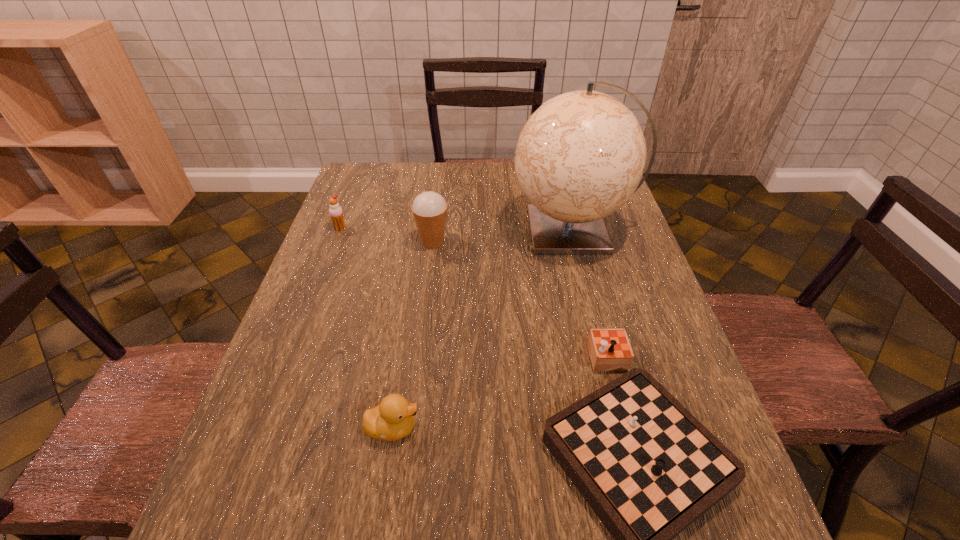
At what (x,y) coordinates should I click in order to perform the action: click on free spot between the globe and the duckling. Please return your answer as a coordinate pair (x, y). Looking at the image, I should click on (482, 329).

The height and width of the screenshot is (540, 960). I want to click on free spot between the duckling and the farther icecream, so click(367, 328).

You are a GUI agent. You are given a task and a screenshot of the screen. Output one action in this format:
    pyautogui.click(x=<x>, y=<y>)
    Task: Click on the vacant space that is in between the leftmost object and the duckling
    
    Given the screenshot: What is the action you would take?
    pyautogui.click(x=367, y=328)

At what (x,y) coordinates should I click in order to perform the action: click on vacant area between the right icecream and the tallest object. Please return your answer as a coordinate pair (x, y). The image size is (960, 540). Looking at the image, I should click on (502, 237).

At what (x,y) coordinates should I click in order to perform the action: click on unoccupied position between the globe and the duckling. Please return your answer as a coordinate pair (x, y). Image resolution: width=960 pixels, height=540 pixels. Looking at the image, I should click on (482, 329).

Locate an element on the screen. free space between the second tallest object and the duckling is located at coordinates (413, 335).

The image size is (960, 540). Find the location of `free space between the globe and the second tallest object`. free space between the globe and the second tallest object is located at coordinates (502, 237).

Identify the location of object that is the third closest to the second tallest object. Image resolution: width=960 pixels, height=540 pixels. (647, 467).

Select which object is the second closest to the taller icecream. Please provide its 2D coordinates. Your answer should be formatted as a tuple, i.e. [(x, y)], where the tuple contains the x and y coordinates of a point satisfying the conditions above.

[(336, 213)]

Locate an element on the screen. vacant region that satisfies the following two spatial constraints: 1. on the surface of the globe showing Europe and Africa; 2. on the front side of the taller icecream is located at coordinates (575, 242).